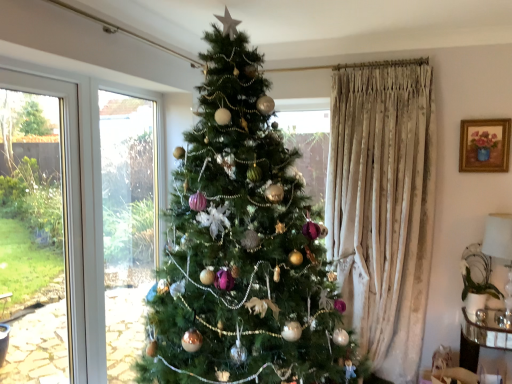
Question: Can you confirm if gold-framed painting at upper right is positioned to the right of white glossy lampshade at right?

Choices:
 (A) no
 (B) yes

Answer: (A)

Question: From the image's perspective, is gold-framed painting at upper right over white glossy lampshade at right?

Choices:
 (A) no
 (B) yes

Answer: (B)

Question: Does gold-framed painting at upper right have a smaller size compared to white glossy lampshade at right?

Choices:
 (A) no
 (B) yes

Answer: (B)

Question: Is gold-framed painting at upper right bigger than white glossy lampshade at right?

Choices:
 (A) no
 (B) yes

Answer: (A)

Question: From a real-world perspective, is gold-framed painting at upper right on top of white glossy lampshade at right?

Choices:
 (A) no
 (B) yes

Answer: (B)

Question: Relative to green matte christmas tree at center, is clear glass side table at lower right in front or behind?

Choices:
 (A) behind
 (B) front

Answer: (A)

Question: Is point (468, 339) closer or farther from the camera than point (324, 369)?

Choices:
 (A) closer
 (B) farther

Answer: (B)

Question: Is clear glass side table at lower right taller or shorter than green matte christmas tree at center?

Choices:
 (A) tall
 (B) short

Answer: (B)

Question: In terms of width, does clear glass side table at lower right look wider or thinner when compared to green matte christmas tree at center?

Choices:
 (A) thin
 (B) wide

Answer: (A)

Question: Considering the positions of white glossy lampshade at right and clear glass side table at lower right in the image, is white glossy lampshade at right bigger or smaller than clear glass side table at lower right?

Choices:
 (A) small
 (B) big

Answer: (A)

Question: Is white glossy lampshade at right taller or shorter than clear glass side table at lower right?

Choices:
 (A) short
 (B) tall

Answer: (B)

Question: Considering the positions of white glossy lampshade at right and clear glass side table at lower right in the image, is white glossy lampshade at right wider or thinner than clear glass side table at lower right?

Choices:
 (A) wide
 (B) thin

Answer: (B)

Question: Which is correct: white glossy lampshade at right is inside clear glass side table at lower right, or outside of it?

Choices:
 (A) inside
 (B) outside

Answer: (B)

Question: In the image, is green matte christmas tree at center on the left side or the right side of gold-framed painting at upper right?

Choices:
 (A) right
 (B) left

Answer: (B)

Question: From the image's perspective, is green matte christmas tree at center positioned above or below gold-framed painting at upper right?

Choices:
 (A) above
 (B) below

Answer: (B)